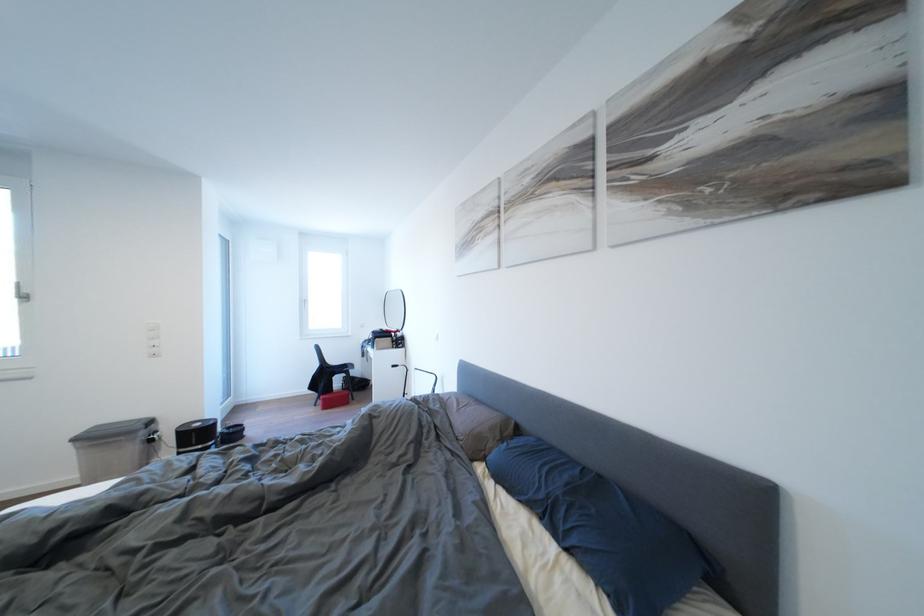
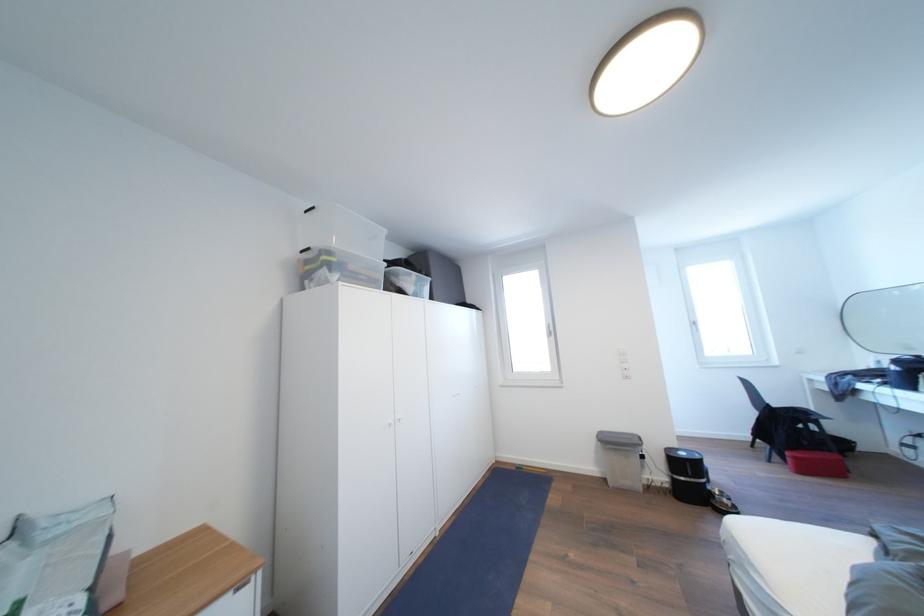
In the second image, find the point that corresponds to point (148, 424) in the first image.

(639, 440)